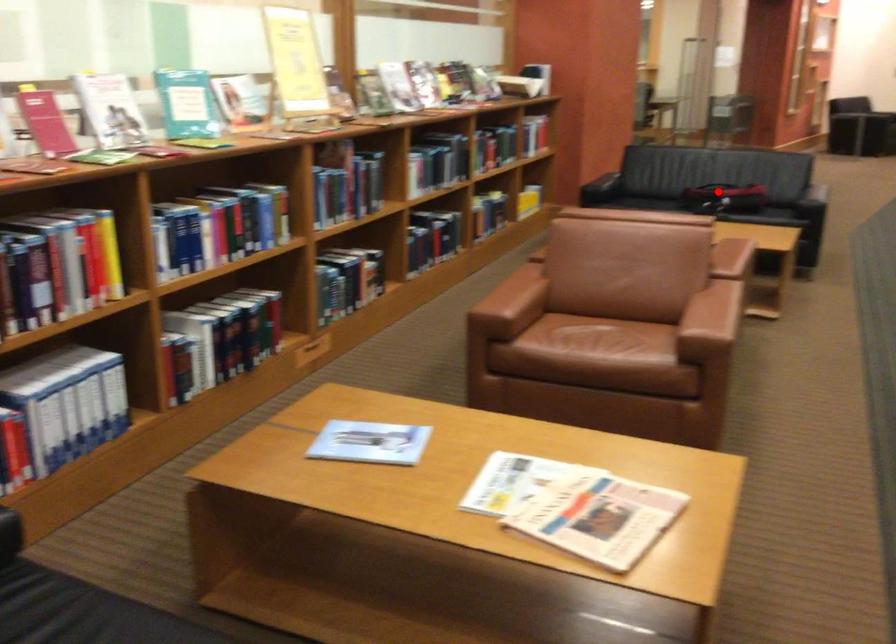
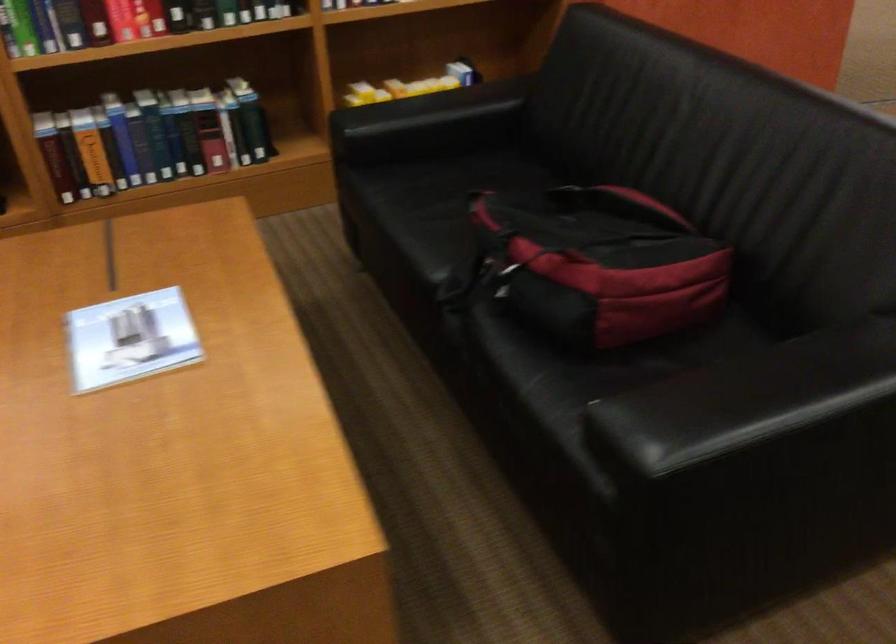
Question: I am providing you with two images of the same scene from different viewpoints. In image1, a red point is highlighted. Considering the same 3D point in image2, which of the following is correct?

Choices:
 (A) It is closer
 (B) It is farther

Answer: (A)